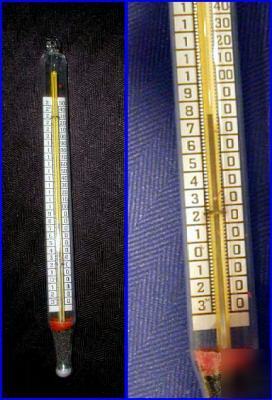
You are a GUI agent. You are given a task and a screenshot of the screen. Output one action in this format:
    pyautogui.click(x=<x>, y=<y>)
    Task: Click on the thermometer
    This screenshot has width=272, height=400.
    Given the screenshot: What is the action you would take?
    pyautogui.click(x=52, y=65)